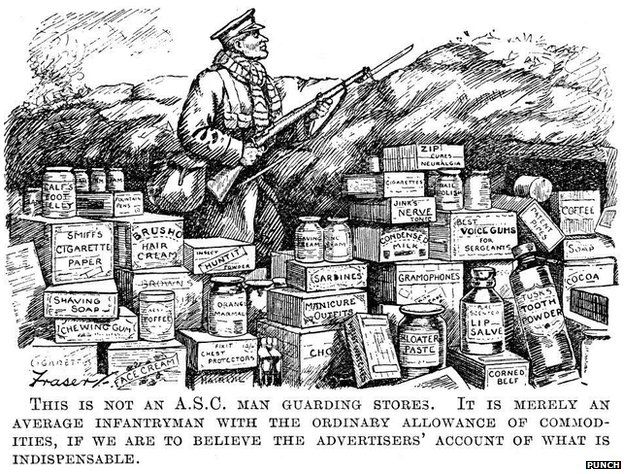
Locate an element on the screen. The height and width of the screenshot is (474, 624). illustrated bottle of lip salve is located at coordinates (483, 324).